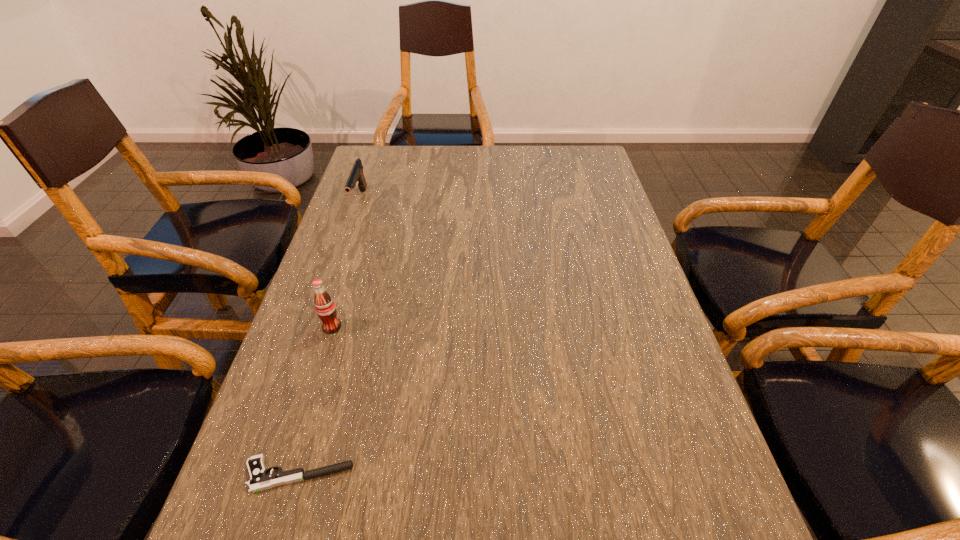
In the image, there is a desktop. At what (x,y) coordinates should I click in order to perform the action: click on vacant region at the left edge. Please return your answer as a coordinate pair (x, y). Looking at the image, I should click on (297, 456).

In the image, there is a desktop. At what (x,y) coordinates should I click in order to perform the action: click on free space at the right edge. Please return your answer as a coordinate pair (x, y). The width and height of the screenshot is (960, 540). Looking at the image, I should click on (634, 245).

I want to click on vacant point located between the nearer pistol and the farthest object, so click(329, 338).

You are a GUI agent. You are given a task and a screenshot of the screen. Output one action in this format:
    pyautogui.click(x=<x>, y=<y>)
    Task: Click on the free spot between the farther pistol and the soda
    
    Given the screenshot: What is the action you would take?
    tap(346, 264)

This screenshot has height=540, width=960. Identify the location of free space between the second shortest object and the tallest object. pos(346,264).

What are the coordinates of `free space between the second shortest object and the second nearest object` in the screenshot? It's located at (346, 264).

Where is `free area in between the farthest object and the second nearest object`? free area in between the farthest object and the second nearest object is located at coordinates (346, 264).

What are the coordinates of `vacant area between the soda and the farther pistol` in the screenshot? It's located at (346, 264).

Locate an element on the screen. The height and width of the screenshot is (540, 960). free space between the farthest object and the second nearest object is located at coordinates (346, 264).

You are a GUI agent. You are given a task and a screenshot of the screen. Output one action in this format:
    pyautogui.click(x=<x>, y=<y>)
    Task: Click on the free space that is in between the farther pistol and the second nearest object
    This screenshot has width=960, height=540.
    Given the screenshot: What is the action you would take?
    pyautogui.click(x=346, y=264)